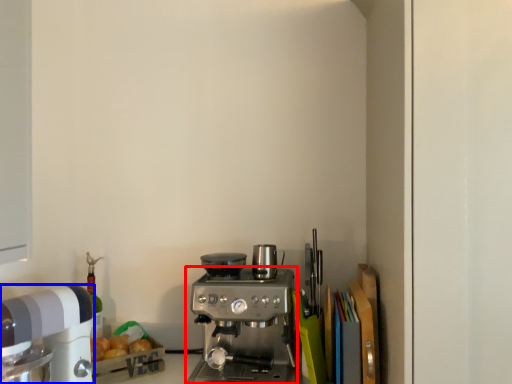
Question: Which of the following is the farthest to the observer, coffee maker (highlighted by a red box) or kitchen appliance (highlighted by a blue box)?

Choices:
 (A) coffee maker
 (B) kitchen appliance

Answer: (A)